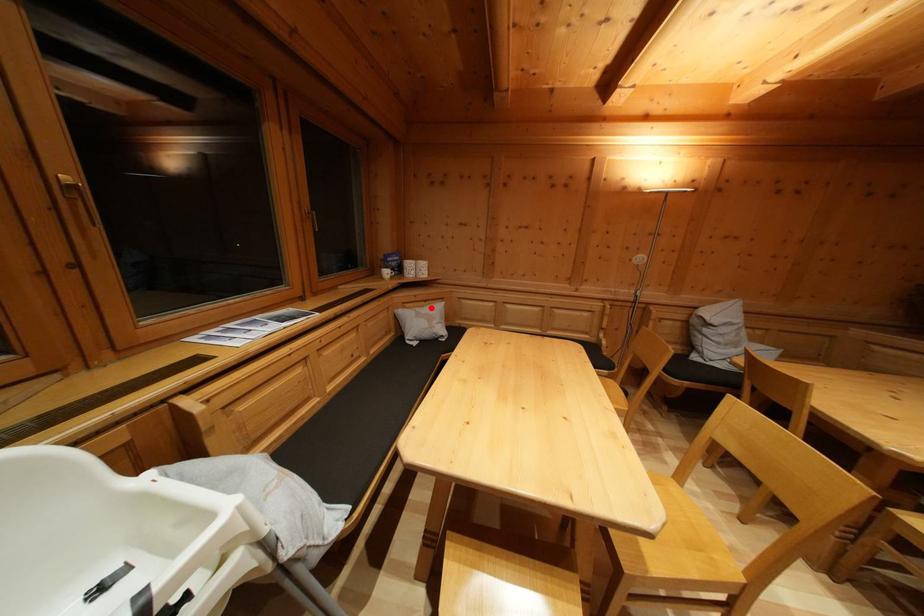
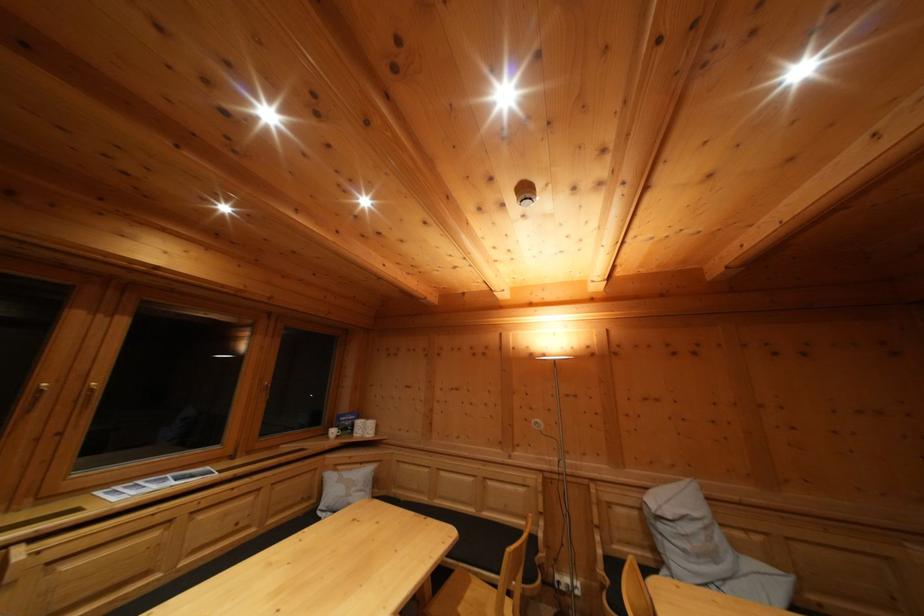
Locate, in the second image, the point that corresponds to the highlighted location in the first image.

(368, 469)